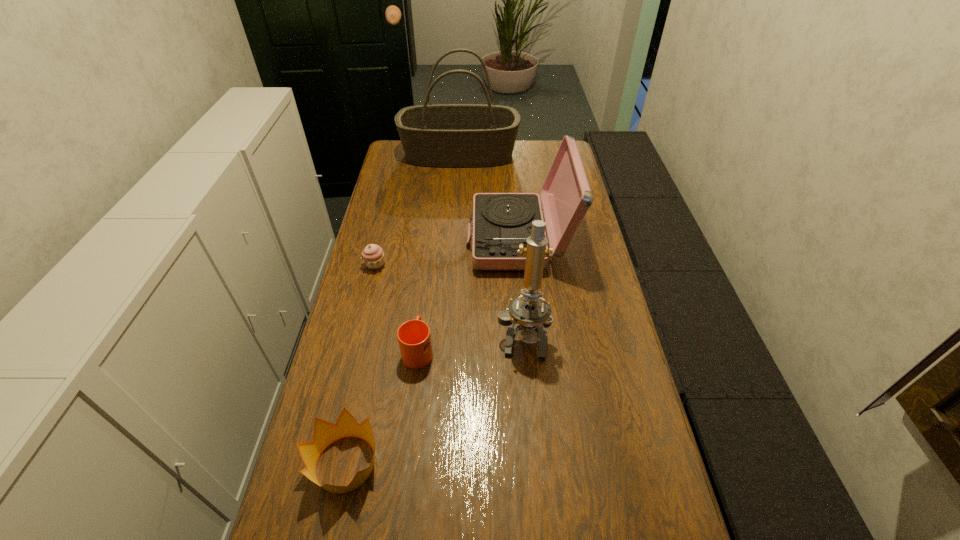
You are a GUI agent. You are given a task and a screenshot of the screen. Output one action in this format:
    pyautogui.click(x=<x>, y=<y>)
    Task: Click on the object situated at the right edge
    
    Given the screenshot: What is the action you would take?
    pyautogui.click(x=501, y=221)

The width and height of the screenshot is (960, 540). Identify the location of object located at the far left corner. (441, 135).

Where is `vacant space at the far edge`? The height and width of the screenshot is (540, 960). vacant space at the far edge is located at coordinates (518, 143).

In the image, there is a desktop. At what (x,y) coordinates should I click in order to perform the action: click on vacant space at the left edge. Please return your answer as a coordinate pair (x, y). The width and height of the screenshot is (960, 540). Looking at the image, I should click on (370, 280).

This screenshot has width=960, height=540. I want to click on free region at the right edge, so click(588, 263).

This screenshot has height=540, width=960. Find the location of `free space at the far right corner of the desktop`. free space at the far right corner of the desktop is located at coordinates pos(533,142).

This screenshot has width=960, height=540. In order to click on empty location between the shortest object and the record player in this screenshot , I will do `click(447, 252)`.

You are a GUI agent. You are given a task and a screenshot of the screen. Output one action in this format:
    pyautogui.click(x=<x>, y=<y>)
    Task: Click on the free point between the microscope and the nearest object
    
    Given the screenshot: What is the action you would take?
    tap(434, 399)

Where is `free space between the basket and the mug`? This screenshot has height=540, width=960. free space between the basket and the mug is located at coordinates (439, 253).

This screenshot has width=960, height=540. I want to click on vacant area that lies between the mug and the farthest object, so click(x=439, y=253).